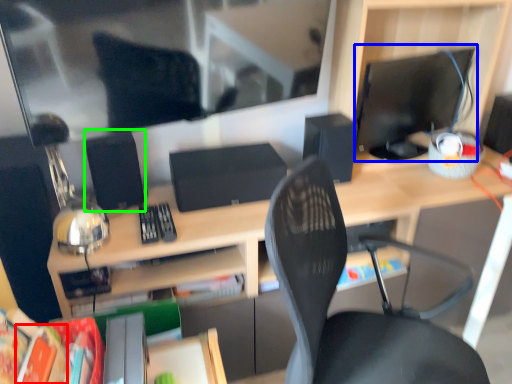
Question: Considering the real-world distances, which object is farthest from paperback book (highlighted by a red box)? computer monitor (highlighted by a blue box) or speaker (highlighted by a green box)?

Choices:
 (A) computer monitor
 (B) speaker

Answer: (A)